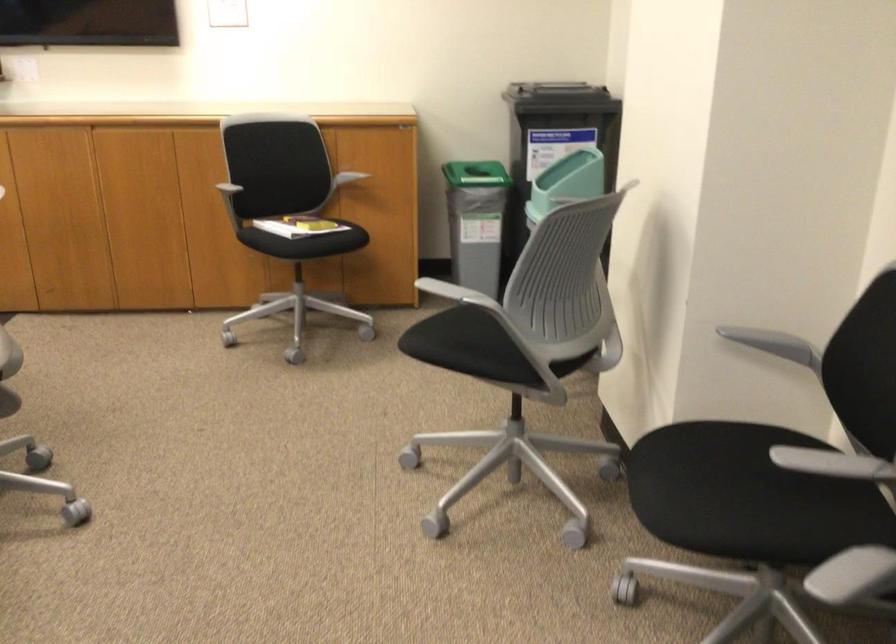
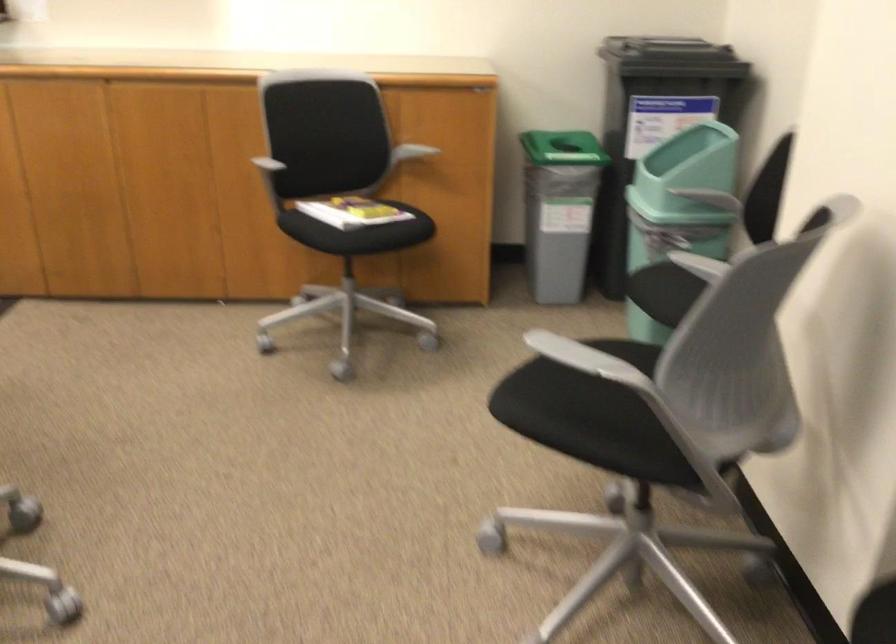
Where in the second image is the point corresponding to point (201, 178) from the first image?

(236, 149)